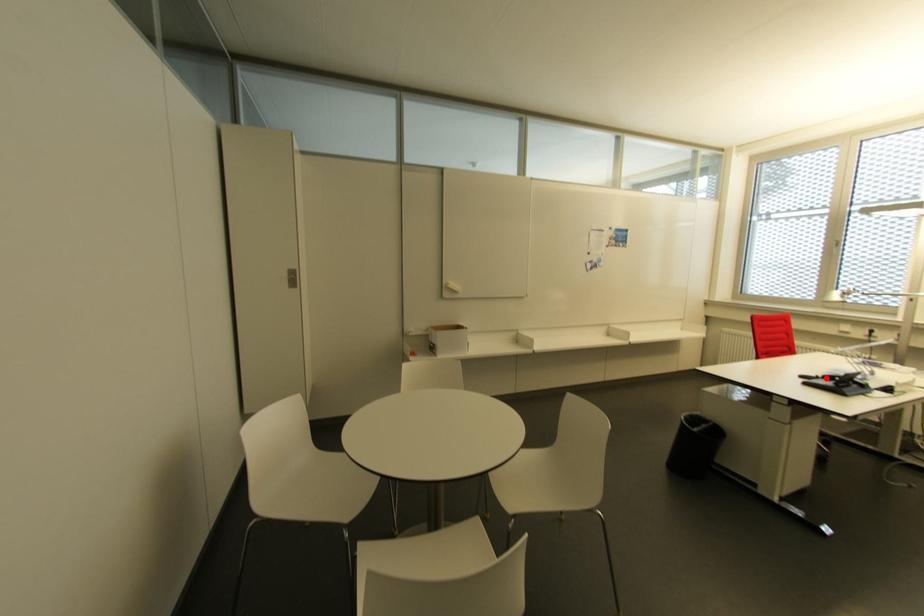
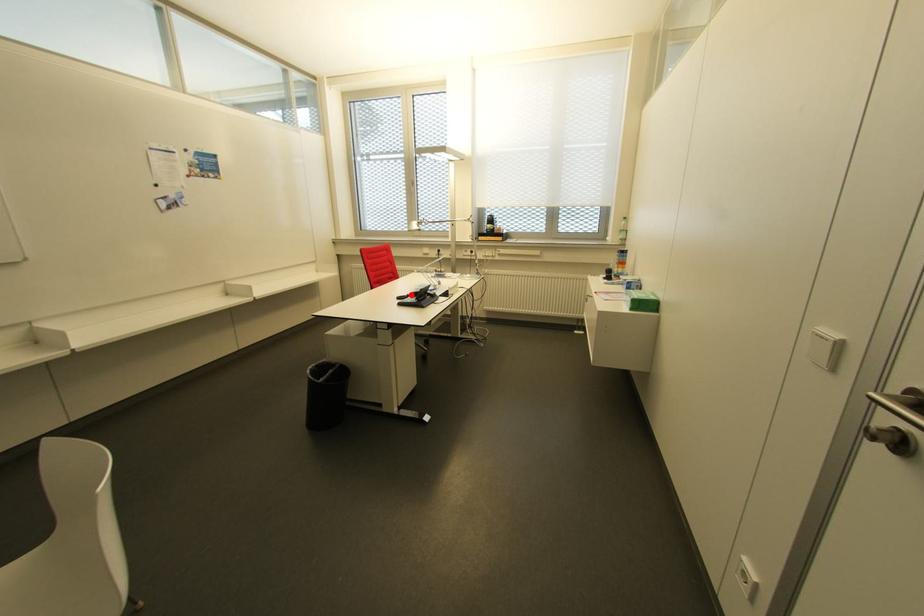
I am providing you with two images of the same scene from different viewpoints. A red point is marked on the first image and another point is marked on the second image. Do the highlighted points in image1 and image2 indicate the same real-world spot?

Yes